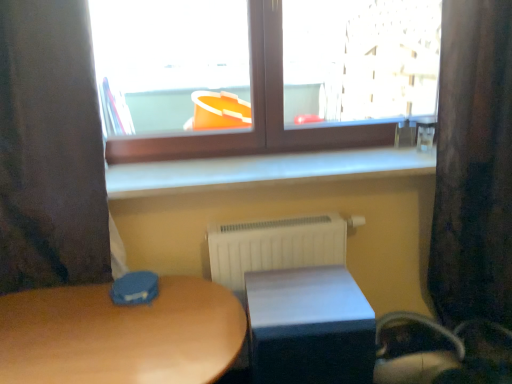
The height and width of the screenshot is (384, 512). What do you see at coordinates (50, 149) in the screenshot?
I see `dark fabric curtain at left, placed as the 1th curtain when sorted from left to right` at bounding box center [50, 149].

Measure the distance between dark fabric curtain at left, placed as the 1th curtain when sorted from left to right, and camera.

dark fabric curtain at left, placed as the 1th curtain when sorted from left to right, is 3.74 feet away from camera.

What do you see at coordinates (277, 245) in the screenshot? The height and width of the screenshot is (384, 512). I see `white plastic radiator at center` at bounding box center [277, 245].

This screenshot has width=512, height=384. What do you see at coordinates (473, 165) in the screenshot?
I see `velvet dark brown curtain at right, placed as the 1th curtain when sorted from right to left` at bounding box center [473, 165].

What is the approximate height of white matte table at lower center, acting as the 2th table starting from the left?

It is 19.27 inches.

Locate an element on the screen. white smooth window sill at center is located at coordinates (264, 171).

Find the location of a particular element. Image resolution: width=512 pixels, height=384 pixels. dark fabric curtain at left, placed as the 1th curtain when sorted from left to right is located at coordinates tap(50, 149).

Can we say velvet dark brown curtain at right, placed as the 1th curtain when sorted from right to left, lies outside matte wooden table at center, arranged as the 1th table when viewed from the left?

Yes.

From a real-world perspective, is velvet dark brown curtain at right, the 2th curtain viewed from the left, on matte wooden table at center, the second table positioned from the right?

Yes, from a real-world perspective, velvet dark brown curtain at right, the 2th curtain viewed from the left, is over matte wooden table at center, the second table positioned from the right

Could you measure the distance between velvet dark brown curtain at right, placed as the 1th curtain when sorted from right to left, and matte wooden table at center, arranged as the 1th table when viewed from the left?

velvet dark brown curtain at right, placed as the 1th curtain when sorted from right to left, and matte wooden table at center, arranged as the 1th table when viewed from the left, are 3.67 feet apart from each other.

What's the angular difference between velvet dark brown curtain at right, the 2th curtain viewed from the left, and matte wooden table at center, the second table positioned from the right,'s facing directions?

The angular difference between velvet dark brown curtain at right, the 2th curtain viewed from the left, and matte wooden table at center, the second table positioned from the right, is 0.595 degrees.

The height and width of the screenshot is (384, 512). What are the coordinates of `window sill on the right of white matte table at lower center, acting as the 2th table starting from the left` in the screenshot? It's located at (264, 171).

From a real-world perspective, is white matte table at lower center, placed as the 1th table when sorted from right to left, positioned under white smooth window sill at center based on gravity?

Yes, from a real-world perspective, white matte table at lower center, placed as the 1th table when sorted from right to left, is under white smooth window sill at center.

Would you say white matte table at lower center, acting as the 2th table starting from the left, contains white smooth window sill at center?

No, white smooth window sill at center is not inside white matte table at lower center, acting as the 2th table starting from the left.

Is the surface of white matte table at lower center, acting as the 2th table starting from the left, in direct contact with white smooth window sill at center?

No.

Who is bigger, matte wooden table at center, arranged as the 1th table when viewed from the left, or dark fabric curtain at left, positioned as the 2th curtain in right-to-left order?

With larger size is matte wooden table at center, arranged as the 1th table when viewed from the left.

Is matte wooden table at center, arranged as the 1th table when viewed from the left, far from dark fabric curtain at left, positioned as the 2th curtain in right-to-left order?

No, there isn't a large distance between matte wooden table at center, arranged as the 1th table when viewed from the left, and dark fabric curtain at left, positioned as the 2th curtain in right-to-left order.

From a real-world perspective, which is physically above, matte wooden table at center, arranged as the 1th table when viewed from the left, or dark fabric curtain at left, placed as the 1th curtain when sorted from left to right?

dark fabric curtain at left, placed as the 1th curtain when sorted from left to right, from a real-world perspective.

In the image, is matte wooden table at center, arranged as the 1th table when viewed from the left, positioned in front of or behind brown wooden window at upper center?

matte wooden table at center, arranged as the 1th table when viewed from the left, is positioned closer to the viewer than brown wooden window at upper center.

Would you say matte wooden table at center, arranged as the 1th table when viewed from the left, is to the left or to the right of brown wooden window at upper center in the picture?

matte wooden table at center, arranged as the 1th table when viewed from the left, is positioned on brown wooden window at upper center's left side.

Is brown wooden window at upper center inside matte wooden table at center, the second table positioned from the right?

No, brown wooden window at upper center is not inside matte wooden table at center, the second table positioned from the right.

Does point (76, 288) appear closer or farther from the camera than point (394, 94)?

Clearly, point (76, 288) is closer to the camera than point (394, 94).

From a real-world perspective, is velvet dark brown curtain at right, the 2th curtain viewed from the left, beneath white plastic radiator at center?

No, from a real-world perspective, velvet dark brown curtain at right, the 2th curtain viewed from the left, is not under white plastic radiator at center.

From the image's perspective, which one is positioned higher, velvet dark brown curtain at right, placed as the 1th curtain when sorted from right to left, or white plastic radiator at center?

From the image's view, velvet dark brown curtain at right, placed as the 1th curtain when sorted from right to left, is above.

How many degrees apart are the facing directions of velvet dark brown curtain at right, placed as the 1th curtain when sorted from right to left, and white plastic radiator at center?

velvet dark brown curtain at right, placed as the 1th curtain when sorted from right to left, and white plastic radiator at center are facing 1.86 degrees away from each other.

Is white matte table at lower center, placed as the 1th table when sorted from right to left, facing away from matte wooden table at center, the second table positioned from the right?

That's not correct — white matte table at lower center, placed as the 1th table when sorted from right to left, is not looking away from matte wooden table at center, the second table positioned from the right.

Is white matte table at lower center, placed as the 1th table when sorted from right to left, completely or partially outside of matte wooden table at center, the second table positioned from the right?

Absolutely, white matte table at lower center, placed as the 1th table when sorted from right to left, is external to matte wooden table at center, the second table positioned from the right.

Between white matte table at lower center, placed as the 1th table when sorted from right to left, and matte wooden table at center, the second table positioned from the right, which one appears on the right side from the viewer's perspective?

From the viewer's perspective, white matte table at lower center, placed as the 1th table when sorted from right to left, appears more on the right side.

Is point (345, 319) more distant than point (105, 369)?

Yes, point (345, 319) is behind point (105, 369).

Which object is more forward, brown wooden window at upper center or velvet dark brown curtain at right, placed as the 1th curtain when sorted from right to left?

Positioned in front is velvet dark brown curtain at right, placed as the 1th curtain when sorted from right to left.

Would you consider brown wooden window at upper center to be distant from velvet dark brown curtain at right, placed as the 1th curtain when sorted from right to left?

brown wooden window at upper center is actually quite close to velvet dark brown curtain at right, placed as the 1th curtain when sorted from right to left.

From the image's perspective, is brown wooden window at upper center located above or below velvet dark brown curtain at right, placed as the 1th curtain when sorted from right to left?

Clearly, from the image's perspective, brown wooden window at upper center is above velvet dark brown curtain at right, placed as the 1th curtain when sorted from right to left.

Image resolution: width=512 pixels, height=384 pixels. What are the coordinates of `table that is the 2nd object to the left of the velvet dark brown curtain at right, placed as the 1th curtain when sorted from right to left, starting at the anchor` in the screenshot? It's located at (120, 335).

What are the coordinates of `the 1st table below the white smooth window sill at center (from the image's perspective)` in the screenshot? It's located at (309, 327).

Looking at the image, which one is located closer to white plastic radiator at center, brown wooden window at upper center or matte wooden table at center, arranged as the 1th table when viewed from the left?

matte wooden table at center, arranged as the 1th table when viewed from the left, is positioned closer to the anchor white plastic radiator at center.

Estimate the real-world distances between objects in this image. Which object is further from white plastic radiator at center, brown wooden window at upper center or dark fabric curtain at left, positioned as the 2th curtain in right-to-left order?

dark fabric curtain at left, positioned as the 2th curtain in right-to-left order, is further to white plastic radiator at center.

From the image, which object appears to be farther from white smooth window sill at center, white plastic radiator at center or white matte table at lower center, acting as the 2th table starting from the left?

white matte table at lower center, acting as the 2th table starting from the left, is positioned further to the anchor white smooth window sill at center.

Looking at the image, which one is located closer to velvet dark brown curtain at right, the 2th curtain viewed from the left, white plastic radiator at center or matte wooden table at center, the second table positioned from the right?

Among the two, white plastic radiator at center is located nearer to velvet dark brown curtain at right, the 2th curtain viewed from the left.

When comparing their distances from dark fabric curtain at left, placed as the 1th curtain when sorted from left to right, does matte wooden table at center, arranged as the 1th table when viewed from the left, or white plastic radiator at center seem closer?

matte wooden table at center, arranged as the 1th table when viewed from the left, lies closer to dark fabric curtain at left, placed as the 1th curtain when sorted from left to right, than the other object.

Which object lies further to the anchor point white smooth window sill at center, dark fabric curtain at left, positioned as the 2th curtain in right-to-left order, or brown wooden window at upper center?

dark fabric curtain at left, positioned as the 2th curtain in right-to-left order, is further to white smooth window sill at center.

Based on their spatial positions, is matte wooden table at center, arranged as the 1th table when viewed from the left, or white matte table at lower center, acting as the 2th table starting from the left, further from velvet dark brown curtain at right, the 2th curtain viewed from the left?

matte wooden table at center, arranged as the 1th table when viewed from the left, is further to velvet dark brown curtain at right, the 2th curtain viewed from the left.

Based on their spatial positions, is dark fabric curtain at left, placed as the 1th curtain when sorted from left to right, or velvet dark brown curtain at right, the 2th curtain viewed from the left, closer to white matte table at lower center, placed as the 1th table when sorted from right to left?

velvet dark brown curtain at right, the 2th curtain viewed from the left.

Where is `radiator situated between matte wooden table at center, the second table positioned from the right, and velvet dark brown curtain at right, placed as the 1th curtain when sorted from right to left, from left to right`? The width and height of the screenshot is (512, 384). radiator situated between matte wooden table at center, the second table positioned from the right, and velvet dark brown curtain at right, placed as the 1th curtain when sorted from right to left, from left to right is located at coordinates [x=277, y=245].

Where is `window sill between white matte table at lower center, placed as the 1th table when sorted from right to left, and velvet dark brown curtain at right, the 2th curtain viewed from the left, in the horizontal direction`? The image size is (512, 384). window sill between white matte table at lower center, placed as the 1th table when sorted from right to left, and velvet dark brown curtain at right, the 2th curtain viewed from the left, in the horizontal direction is located at coordinates (264, 171).

Find the location of a particular element. This screenshot has width=512, height=384. window sill between dark fabric curtain at left, positioned as the 2th curtain in right-to-left order, and velvet dark brown curtain at right, the 2th curtain viewed from the left is located at coordinates (264, 171).

Locate an element on the screen. radiator between brown wooden window at upper center and matte wooden table at center, arranged as the 1th table when viewed from the left, in the up-down direction is located at coordinates (277, 245).